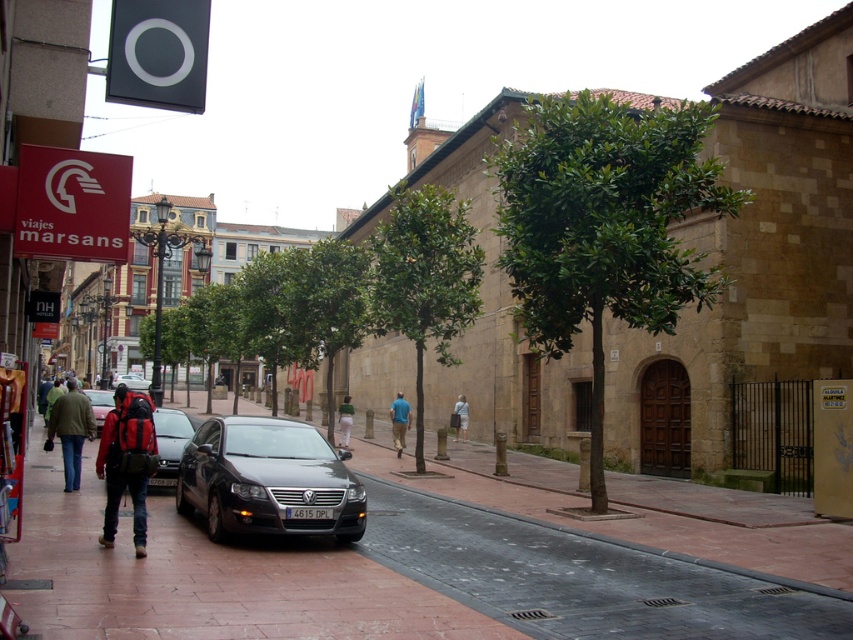
Question: Does red backpack at center appear on the right side of shiny black sedan at center?

Choices:
 (A) no
 (B) yes

Answer: (B)

Question: Among these objects, which one is nearest to the camera?

Choices:
 (A) brown brick pavement at center
 (B) red backpack at center
 (C) shiny black sedan at center

Answer: (A)

Question: Can you confirm if satin black car at center is bigger than green fabric pants at center?

Choices:
 (A) yes
 (B) no

Answer: (B)

Question: Which point is closer to the camera?

Choices:
 (A) (161, 467)
 (B) (343, 412)
 (C) (140, 381)
 (D) (109, 464)

Answer: (D)

Question: Estimate the real-world distances between objects in this image. Which object is closer to the shiny black sedan at center?

Choices:
 (A) blue cotton shirt at center
 (B) light blue denim pants at center

Answer: (A)

Question: Is satin black car at center thinner than green fabric jacket at left?

Choices:
 (A) no
 (B) yes

Answer: (B)